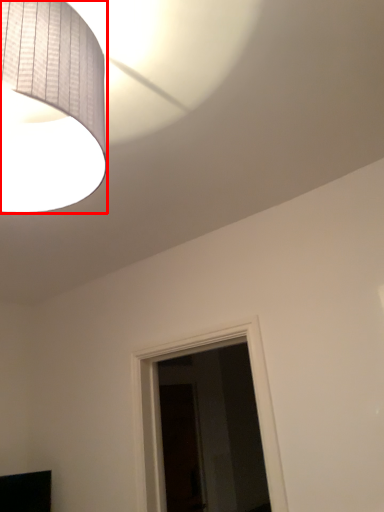
Question: From the image's perspective, where is lamp (annotated by the red box) located in relation to furniture in the image?

Choices:
 (A) below
 (B) above

Answer: (B)